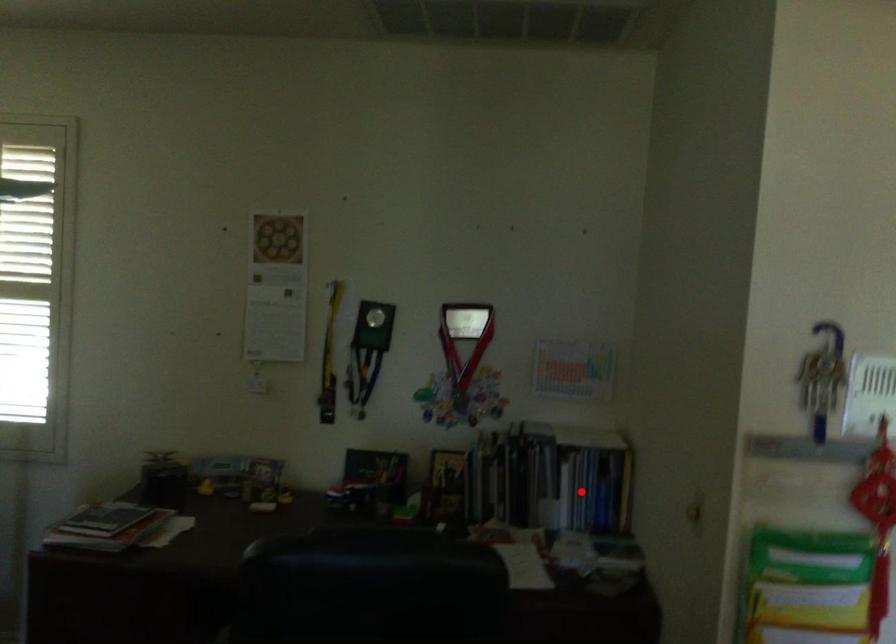
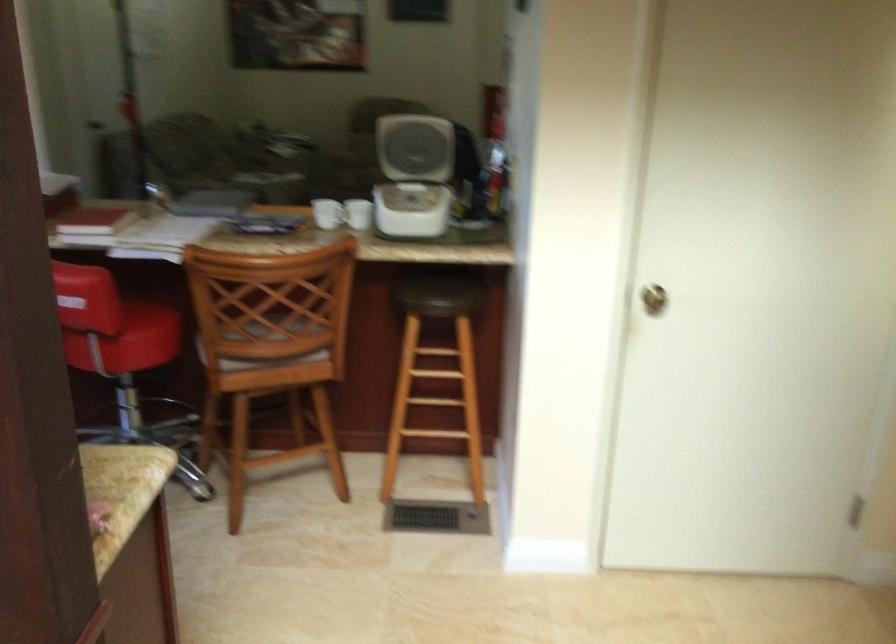
Question: I am providing you with two images of the same scene from different viewpoints. A red point is marked on the first image. Is the red point's position out of view in image 2?

Choices:
 (A) Yes
 (B) No

Answer: (A)